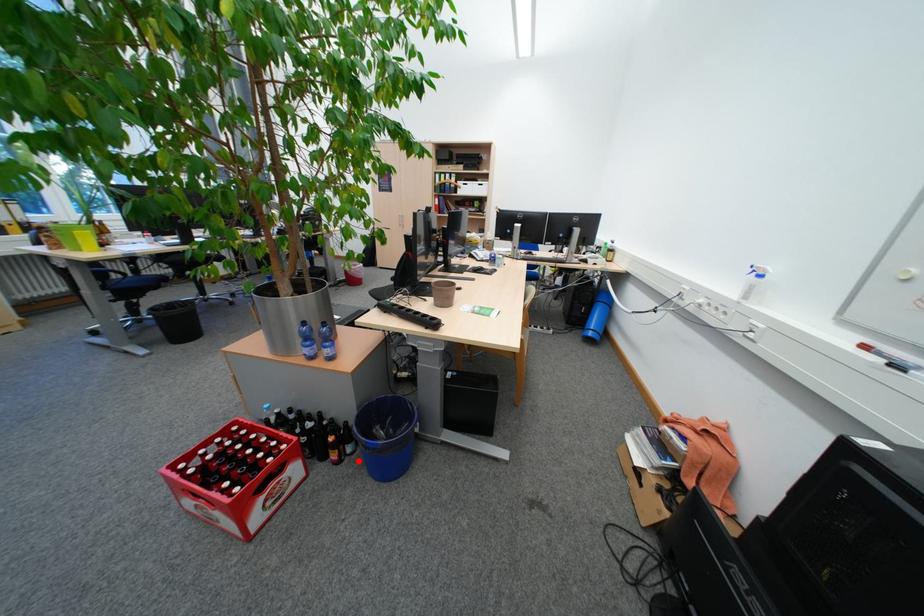
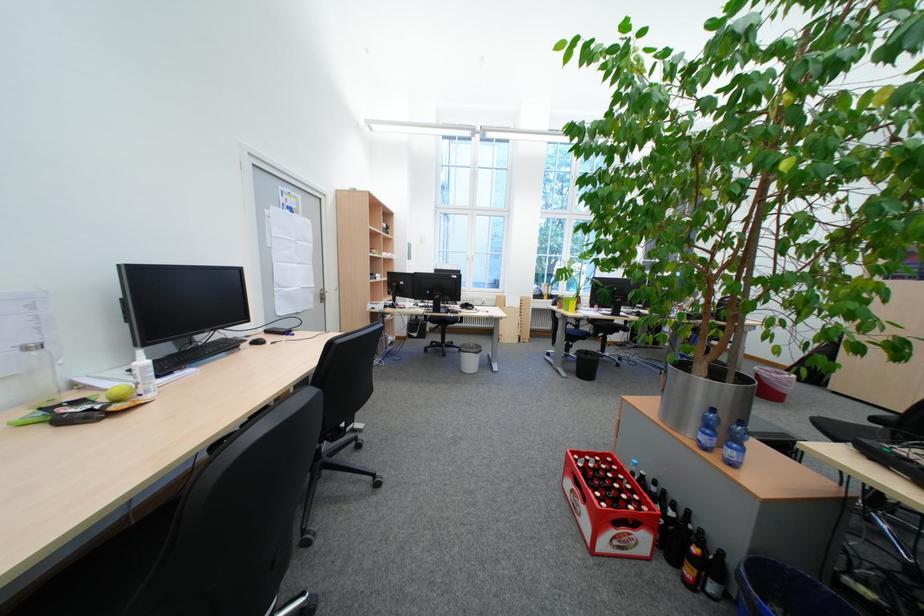
Question: A red point is marked in image1. In image2, is the corresponding 3D point closer to the camera or farther? Reply with the corresponding letter.

Choices:
 (A) The corresponding 3D point is closer.
 (B) The corresponding 3D point is farther.

Answer: (A)